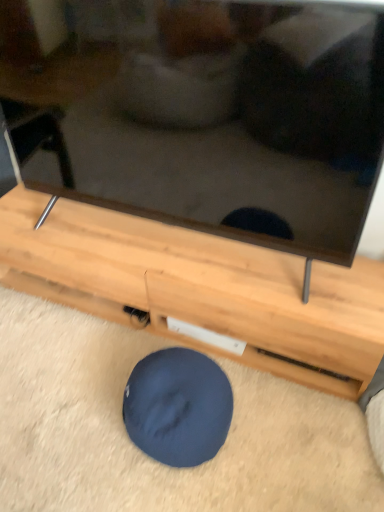
Where is `blank space situated above wooden tv stand at center (from a real-world perspective)`? blank space situated above wooden tv stand at center (from a real-world perspective) is located at coordinates (176, 248).